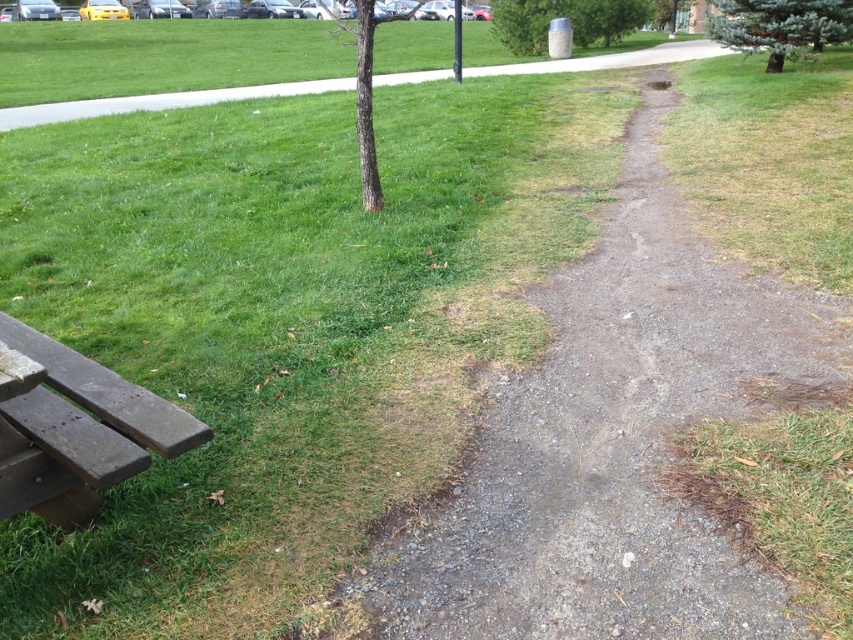
Question: Which object is positioned farthest from the green needle-like tree at upper right?

Choices:
 (A) dirt/gravel path at center
 (B) brown rough bark tree at center
 (C) weathered wood bench at lower left

Answer: (C)

Question: Does green needle-like tree at upper right have a smaller size compared to brown rough bark tree at center?

Choices:
 (A) yes
 (B) no

Answer: (A)

Question: Can you confirm if dirt/gravel path at center is thinner than green needle-like tree at upper right?

Choices:
 (A) yes
 (B) no

Answer: (B)

Question: Which object is positioned farthest from the gray textured trash can at upper center?

Choices:
 (A) dirt/gravel path at center
 (B) green needle-like tree at upper right
 (C) weathered wood bench at lower left
 (D) brown rough bark tree at center

Answer: (C)

Question: Can you confirm if dirt/gravel path at center is positioned to the right of gray textured trash can at upper center?

Choices:
 (A) no
 (B) yes

Answer: (A)

Question: Which point is closer to the camera taking this photo?

Choices:
 (A) (28, 488)
 (B) (375, 193)
 (C) (845, 3)

Answer: (A)